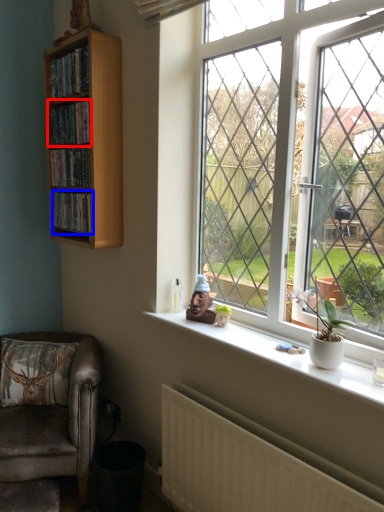
Question: Which of the following is the farthest to the observer, book (highlighted by a red box) or book (highlighted by a blue box)?

Choices:
 (A) book
 (B) book

Answer: (B)